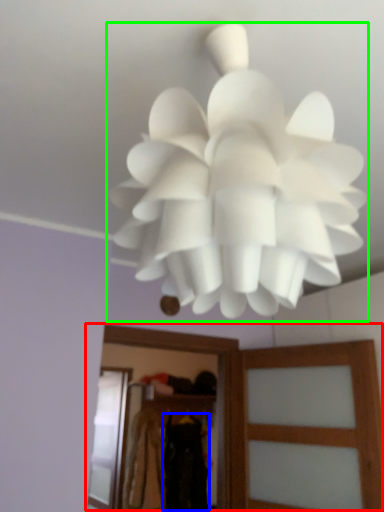
Question: Considering the real-world distances, which object is closest to clothing (highlighted by a red box)? clothing (highlighted by a blue box) or lamp (highlighted by a green box).

Choices:
 (A) clothing
 (B) lamp

Answer: (B)